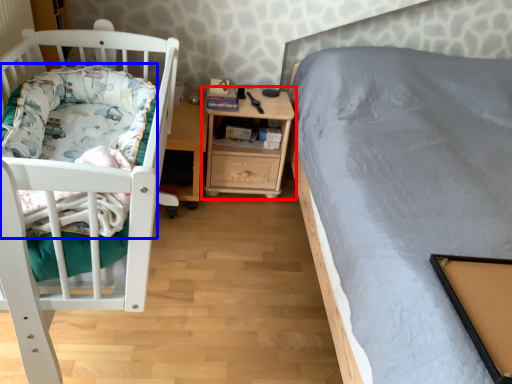
Question: Among these objects, which one is nearest to the camera, nightstand (highlighted by a red box) or blanket (highlighted by a blue box)?

Choices:
 (A) nightstand
 (B) blanket

Answer: (B)